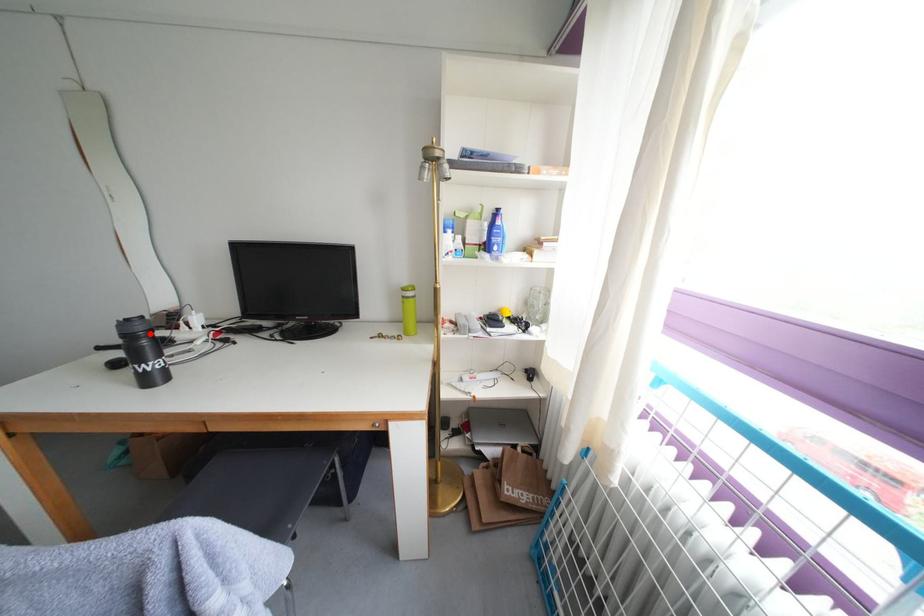
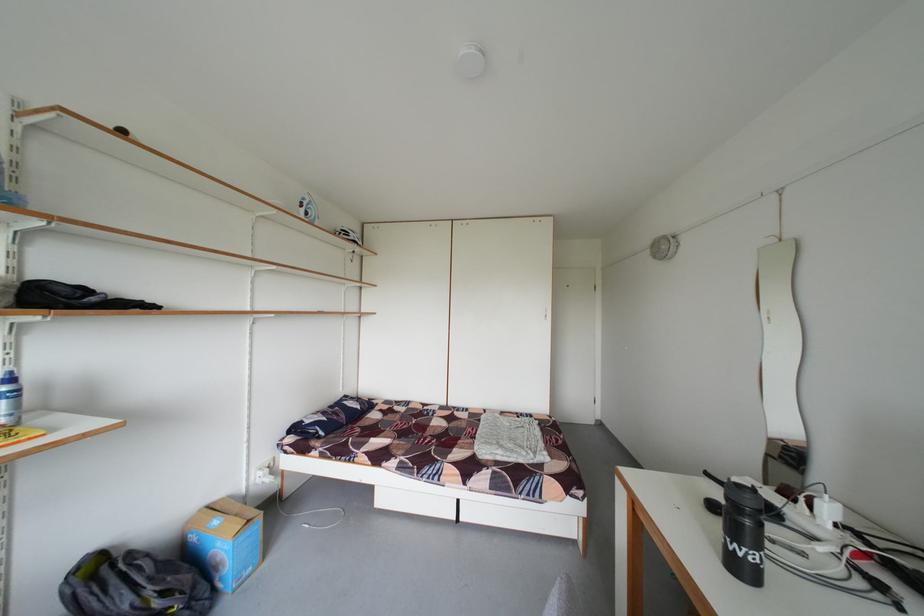
In the second image, find the point that corresponds to the highlighted location in the first image.

(759, 507)